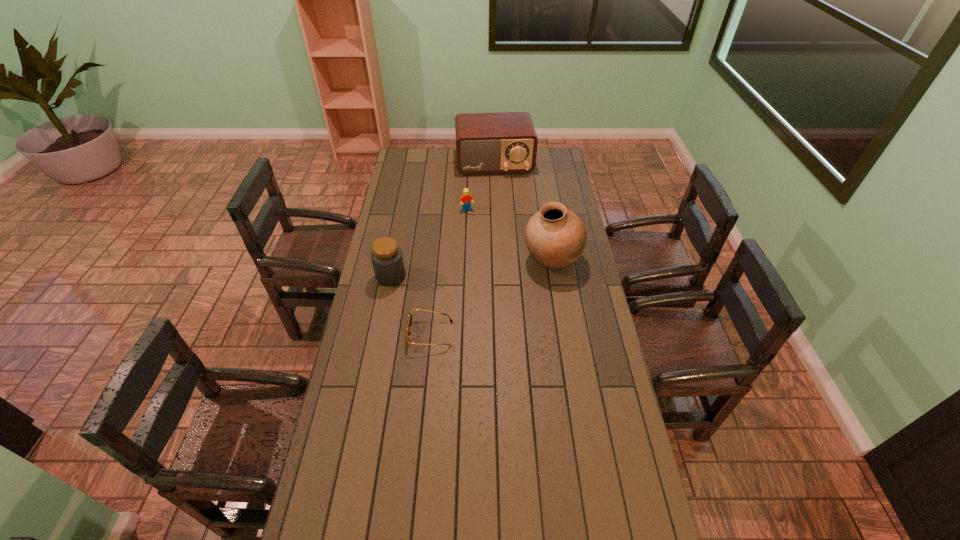
Image resolution: width=960 pixels, height=540 pixels. I want to click on free space between the tallest object and the leftmost object, so click(471, 267).

Identify the location of free spot between the farthest object and the jar. click(443, 219).

This screenshot has height=540, width=960. I want to click on free space between the radio receiver and the Lego, so click(x=481, y=186).

The image size is (960, 540). In order to click on vacant area between the jar and the tallest object in this screenshot , I will do `click(471, 267)`.

At what (x,y) coordinates should I click in order to perform the action: click on free space between the second shortest object and the nearest object. Please return your answer as a coordinate pair (x, y). The width and height of the screenshot is (960, 540). Looking at the image, I should click on (448, 272).

Identify the location of free spot between the nearest object and the leftmost object. The width and height of the screenshot is (960, 540). (411, 305).

Where is `free space between the Lego and the jar`? free space between the Lego and the jar is located at coordinates (429, 243).

This screenshot has height=540, width=960. Find the location of `free space between the jar and the farthest object`. free space between the jar and the farthest object is located at coordinates point(443,219).

Find the location of a particular element. The width and height of the screenshot is (960, 540). object that is the third closest to the sunglasses is located at coordinates (466, 198).

Locate which object is the fourth closest to the third shortest object. Please provide its 2D coordinates. Your answer should be formatted as a tuple, i.e. [(x, y)], where the tuple contains the x and y coordinates of a point satisfying the conditions above.

[(505, 142)]